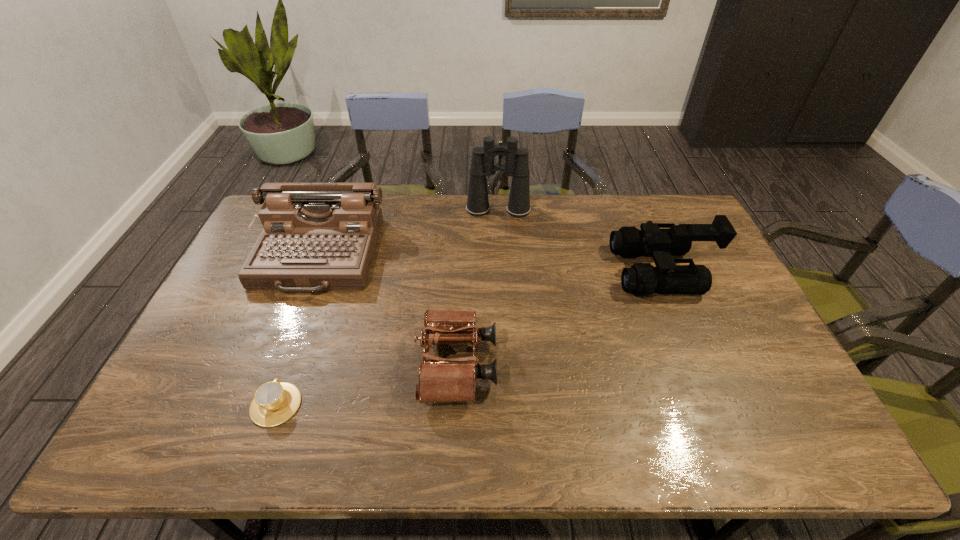
Image resolution: width=960 pixels, height=540 pixels. In order to click on free region located 0.290m on the front lenses of the rightmost binoculars in this screenshot , I will do `click(524, 271)`.

Identify the location of vacant area situated on the front lenses of the rightmost binoculars. The height and width of the screenshot is (540, 960). (515, 271).

I want to click on free space located 0.140m on the front lenses of the rightmost binoculars, so click(x=571, y=271).

Locate an element on the screen. The width and height of the screenshot is (960, 540). vacant area located 0.300m through the eyepieces of the fourth tallest object is located at coordinates (611, 364).

Locate an element on the screen. The image size is (960, 540). vacant area situated 0.280m with the handle on the side of the shortest object is located at coordinates (313, 300).

Where is `free spot located with the handle on the side of the shortest object`? free spot located with the handle on the side of the shortest object is located at coordinates (291, 363).

Where is `vacant area situated 0.360m with the handle on the side of the shortest object`? vacant area situated 0.360m with the handle on the side of the shortest object is located at coordinates (321, 281).

This screenshot has height=540, width=960. In order to click on binoculars present at the far edge in this screenshot , I will do `click(516, 165)`.

You are a GUI agent. You are given a task and a screenshot of the screen. Output one action in this format:
    pyautogui.click(x=<x>, y=<y>)
    Task: Click on the typewriter located at the far edge
    This screenshot has width=960, height=540.
    Given the screenshot: What is the action you would take?
    pyautogui.click(x=316, y=236)

Image resolution: width=960 pixels, height=540 pixels. I want to click on object at the near edge, so click(x=274, y=402).